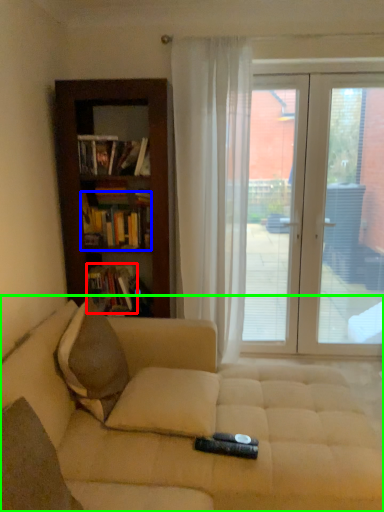
Question: Which object is the closest to the book (highlighted by a red box)? Choose among these: book (highlighted by a blue box) or studio couch (highlighted by a green box).

Choices:
 (A) book
 (B) studio couch

Answer: (A)